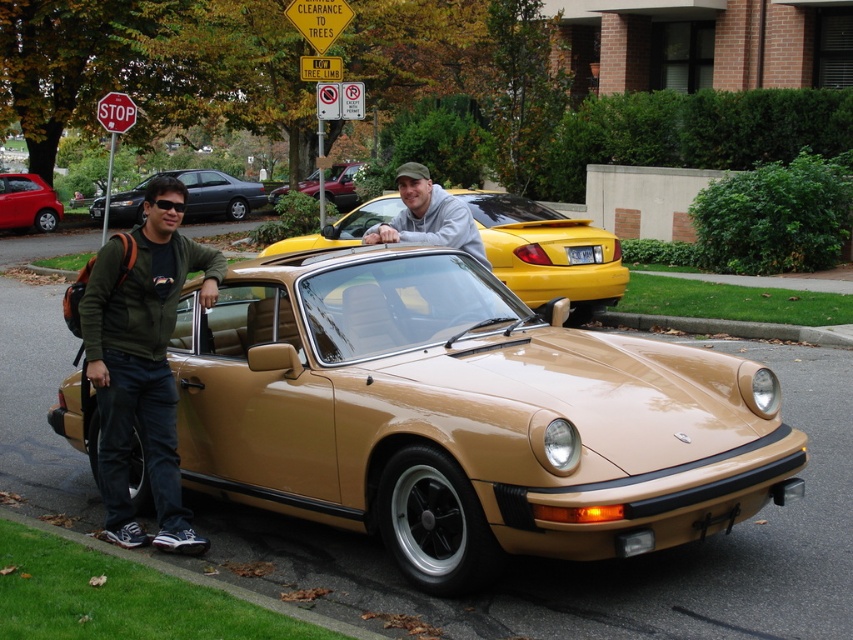
Based on the photo, you are a delivery person who needs to park a delivery van that is 2 meters wide. You see the tan matte convertible at center and the matte black sedan at left in the parking lot. Which vehicle can you park next to without overlapping, considering their widths?

The tan matte convertible at center has a smaller width than the matte black sedan at left, so the delivery van can park next to the tan matte convertible at center without overlapping since it is narrower.

You are a delivery person who needs to attach a package to the matte black sedan at left. The yellow plastic license plate at center is in the way. Can you move the package to the area where the license plate is without removing it?

The matte black sedan at left is above the yellow plastic license plate at center, so you cannot move the package to the area where the license plate is without removing the sedan first.

You are a delivery person who needs to park your vehicle in a spot that requires precise positioning. The parking space is marked with a center point at coordinates 0.395, 0.641. Can you safely park your car in this spot without overlapping the tan matte convertible at center?

The tan matte convertible at center is already located at the center point (x=546, y=252), so you cannot park there without overlapping it.